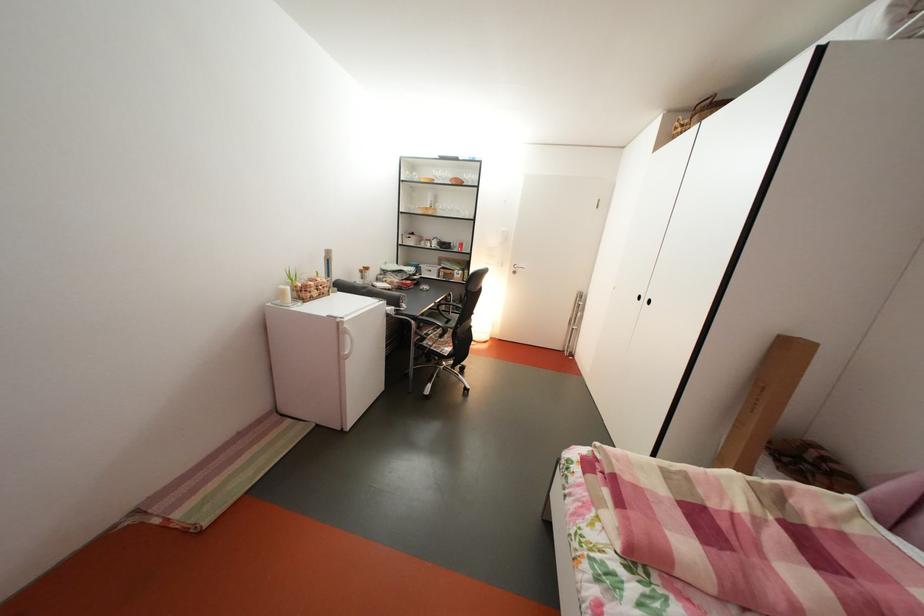
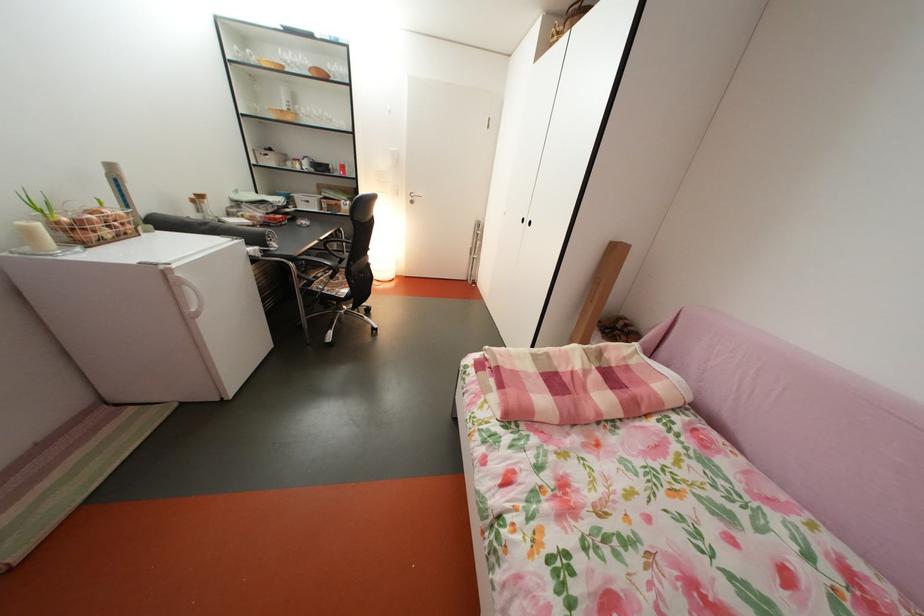
Where in the second image is the point corresponding to [422,248] from the first image?

(283, 168)